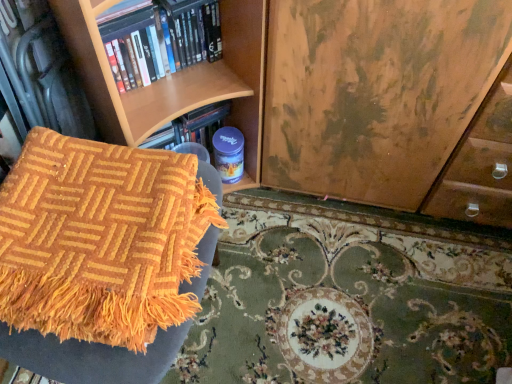
Locate an element on the screen. orange woven blanket at lower left is located at coordinates (102, 258).

The width and height of the screenshot is (512, 384). Describe the element at coordinates (350, 296) in the screenshot. I see `orange woven mat at lower left` at that location.

Find the location of a particular element. orange woven blanket at lower left is located at coordinates (102, 258).

From a real-world perspective, which object stands above the other?

hardcover books at upper left.

Between orange woven mat at lower left and hardcover books at upper left, which one has less height?

orange woven mat at lower left.

In the scene shown: Is orange woven mat at lower left thinner than hardcover books at upper left?

Incorrect, the width of orange woven mat at lower left is not less than that of hardcover books at upper left.

Would you say orange woven blanket at lower left is a long distance from orange woven mat at lower left?

Actually, orange woven blanket at lower left and orange woven mat at lower left are a little close together.

Is orange woven blanket at lower left taller or shorter than orange woven mat at lower left?

In the image, orange woven blanket at lower left appears to be taller than orange woven mat at lower left.

Is orange woven blanket at lower left closer to the viewer compared to orange woven mat at lower left?

Yes, orange woven blanket at lower left is closer to the viewer.

From their relative heights in the image, would you say orange woven blanket at lower left is taller or shorter than hardcover books at upper left?

In the image, orange woven blanket at lower left appears to be shorter than hardcover books at upper left.

Can you tell me how much orange woven blanket at lower left and hardcover books at upper left differ in facing direction?

46.5 degrees separate the facing orientations of orange woven blanket at lower left and hardcover books at upper left.

Considering the positions of point (91, 148) and point (188, 17), is point (91, 148) closer or farther from the camera than point (188, 17)?

Clearly, point (91, 148) is closer to the camera than point (188, 17).

Which point is more forward, (159, 74) or (373, 253)?

Positioned in front is point (159, 74).

Is hardcover books at upper left taller or shorter than orange woven mat at lower left?

hardcover books at upper left is taller than orange woven mat at lower left.

Find the location of `book lying on the left of orange woven mat at lower left`. book lying on the left of orange woven mat at lower left is located at coordinates (158, 38).

Is orange woven mat at lower left with orange woven blanket at lower left?

No, orange woven mat at lower left is not making contact with orange woven blanket at lower left.

From the image's perspective, is orange woven mat at lower left below orange woven blanket at lower left?

Indeed, from the image's perspective, orange woven mat at lower left is shown beneath orange woven blanket at lower left.

Which object is closer to the camera, orange woven mat at lower left or orange woven blanket at lower left?

orange woven blanket at lower left is more forward.

Considering the relative positions of hardcover books at upper left and orange woven blanket at lower left in the image provided, is hardcover books at upper left to the right of orange woven blanket at lower left from the viewer's perspective?

Indeed, hardcover books at upper left is positioned on the right side of orange woven blanket at lower left.

Does hardcover books at upper left have a lesser width compared to orange woven blanket at lower left?

Indeed, hardcover books at upper left has a lesser width compared to orange woven blanket at lower left.

From a real-world perspective, is hardcover books at upper left positioned under orange woven blanket at lower left based on gravity?

Actually, hardcover books at upper left is physically above orange woven blanket at lower left in the real world.

In the image, there is a hardcover books at upper left. Where is `mat below it (from the image's perspective)`? This screenshot has height=384, width=512. mat below it (from the image's perspective) is located at coordinates (350, 296).

Identify the location of furniture on the left side of orange woven mat at lower left. Image resolution: width=512 pixels, height=384 pixels. (102, 258).

Looking at the image, which one is located further to orange woven blanket at lower left, orange woven mat at lower left or hardcover books at upper left?

orange woven mat at lower left is further to orange woven blanket at lower left.

Which object lies nearer to the anchor point orange woven mat at lower left, hardcover books at upper left or orange woven blanket at lower left?

Among the two, orange woven blanket at lower left is located nearer to orange woven mat at lower left.

Based on their spatial positions, is orange woven blanket at lower left or hardcover books at upper left further from orange woven mat at lower left?

hardcover books at upper left is positioned further to the anchor orange woven mat at lower left.

From the picture: Considering their positions, is orange woven mat at lower left positioned closer to hardcover books at upper left than orange woven blanket at lower left?

Among the two, orange woven blanket at lower left is located nearer to hardcover books at upper left.

Looking at the image, which one is located closer to hardcover books at upper left, orange woven blanket at lower left or orange woven mat at lower left?

orange woven blanket at lower left.

When comparing their distances from orange woven blanket at lower left, does hardcover books at upper left or orange woven mat at lower left seem closer?

hardcover books at upper left is positioned closer to the anchor orange woven blanket at lower left.

The image size is (512, 384). What are the coordinates of `furniture between hardcover books at upper left and orange woven mat at lower left vertically` in the screenshot? It's located at (102, 258).